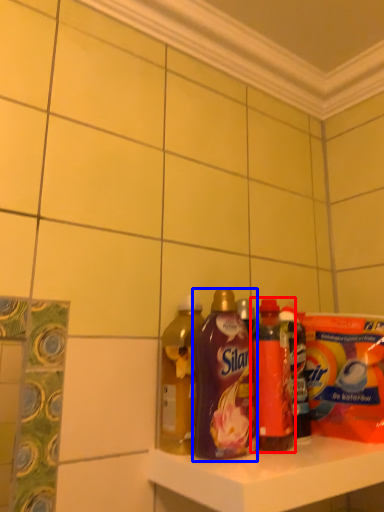
Question: Which object is further to the camera taking this photo, bottle (highlighted by a red box) or bottle (highlighted by a blue box)?

Choices:
 (A) bottle
 (B) bottle

Answer: (A)